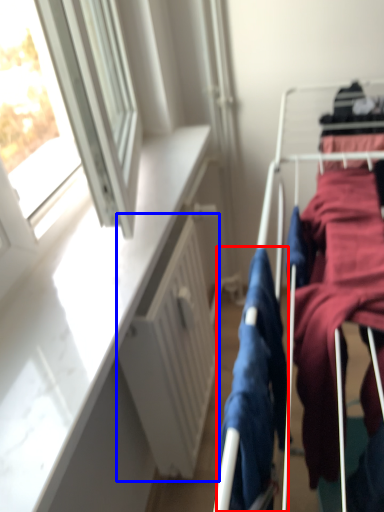
Question: Which object appears closest to the camera in this image, clothing (highlighted by a red box) or radiator (highlighted by a blue box)?

Choices:
 (A) clothing
 (B) radiator

Answer: (A)